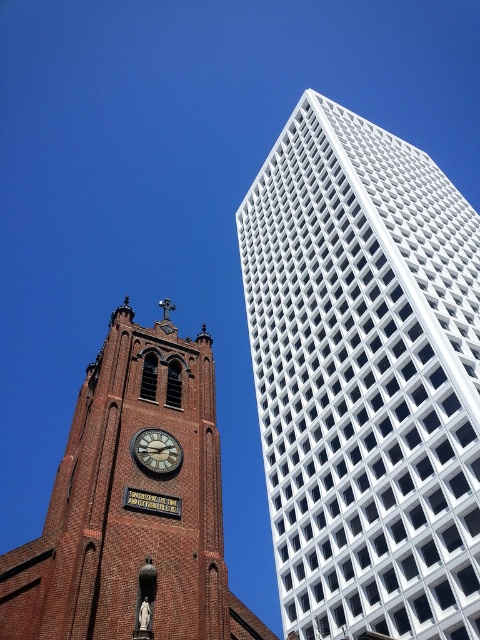
Is brick clock tower at lower left bigger than gold-toned metal clock at center-left?

Indeed, brick clock tower at lower left has a larger size compared to gold-toned metal clock at center-left.

Describe the element at coordinates (132, 506) in the screenshot. I see `brick clock tower at lower left` at that location.

Identify the location of brick clock tower at lower left. (132, 506).

Does white grid-patterned building at upper right have a greater height compared to brick clock tower at lower left?

Yes, white grid-patterned building at upper right is taller than brick clock tower at lower left.

Between white grid-patterned building at upper right and brick clock tower at lower left, which one appears on the left side from the viewer's perspective?

Positioned to the left is brick clock tower at lower left.

Does point (392, 349) come farther from viewer compared to point (144, 340)?

Yes, it is behind point (144, 340).

Locate an element on the screen. white grid-patterned building at upper right is located at coordinates (364, 378).

Does point (387, 572) lie in front of point (152, 445)?

No, (387, 572) is behind (152, 445).

From the picture: How far apart are white grid-patterned building at upper right and gold-toned metal clock at center-left?

white grid-patterned building at upper right and gold-toned metal clock at center-left are 43.96 meters apart.

Locate an element on the screen. white grid-patterned building at upper right is located at coordinates (364, 378).

Where is `white grid-patterned building at upper right`? The image size is (480, 640). white grid-patterned building at upper right is located at coordinates (364, 378).